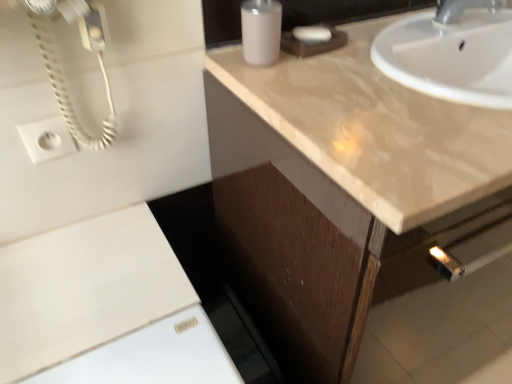
Question: From a real-world perspective, does white matte cabinet at lower left stand above matte brown cabinet at upper right?

Choices:
 (A) yes
 (B) no

Answer: (A)

Question: Are white matte cabinet at lower left and matte brown cabinet at upper right beside each other?

Choices:
 (A) no
 (B) yes

Answer: (A)

Question: Considering the relative positions of white matte cabinet at lower left and matte brown cabinet at upper right in the image provided, is white matte cabinet at lower left to the left of matte brown cabinet at upper right from the viewer's perspective?

Choices:
 (A) no
 (B) yes

Answer: (B)

Question: Is white matte cabinet at lower left at the right side of matte brown cabinet at upper right?

Choices:
 (A) no
 (B) yes

Answer: (A)

Question: Does white matte cabinet at lower left have a greater height compared to matte brown cabinet at upper right?

Choices:
 (A) yes
 (B) no

Answer: (B)

Question: Is white matte cabinet at lower left in front of or behind white matte soap at upper center in the image?

Choices:
 (A) front
 (B) behind

Answer: (A)

Question: Would you say white matte cabinet at lower left is inside or outside white matte soap at upper center?

Choices:
 (A) outside
 (B) inside

Answer: (A)

Question: Looking at their shapes, would you say white matte cabinet at lower left is wider or thinner than white matte soap at upper center?

Choices:
 (A) thin
 (B) wide

Answer: (B)

Question: Is point (10, 276) closer or farther from the camera than point (297, 33)?

Choices:
 (A) farther
 (B) closer

Answer: (B)

Question: Is white matte soap at upper center in front of or behind white matte cabinet at lower left in the image?

Choices:
 (A) behind
 (B) front

Answer: (A)

Question: Considering the positions of white matte soap at upper center and white matte cabinet at lower left in the image, is white matte soap at upper center wider or thinner than white matte cabinet at lower left?

Choices:
 (A) wide
 (B) thin

Answer: (B)

Question: Do you think white matte soap at upper center is within white matte cabinet at lower left, or outside of it?

Choices:
 (A) inside
 (B) outside

Answer: (B)

Question: In the image, is white matte soap at upper center on the left side or the right side of white matte cabinet at lower left?

Choices:
 (A) left
 (B) right

Answer: (B)

Question: Looking at the image, does white matte soap at upper center seem bigger or smaller compared to white plastic outlet at upper left?

Choices:
 (A) small
 (B) big

Answer: (B)

Question: From the image's perspective, relative to white plastic outlet at upper left, is white matte soap at upper center above or below?

Choices:
 (A) below
 (B) above

Answer: (B)